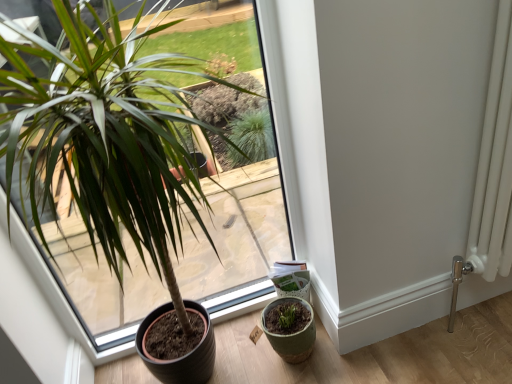
What do you see at coordinates (136, 171) in the screenshot? I see `green matte plant pot at lower left` at bounding box center [136, 171].

Identify the location of green matte plant pot at lower left. The image size is (512, 384). (136, 171).

Identify the location of green matte flowerpot at lower right. (290, 330).

In order to face green matte flowerpot at lower right, should I rotate leftwards or rightwards?

Rotate your view right by about 4.268°.

What do you see at coordinates (290, 330) in the screenshot? I see `green matte flowerpot at lower right` at bounding box center [290, 330].

The image size is (512, 384). Identify the location of green matte plant pot at lower left. (136, 171).

Would you say green matte plant pot at lower left is to the left or to the right of green matte flowerpot at lower right in the picture?

Based on their positions, green matte plant pot at lower left is located to the left of green matte flowerpot at lower right.

Is green matte plant pot at lower left in front of or behind green matte flowerpot at lower right in the image?

Visually, green matte plant pot at lower left is located in front of green matte flowerpot at lower right.

Is point (211, 214) farther from camera compared to point (266, 331)?

That is True.

From the image's perspective, would you say green matte plant pot at lower left is positioned over green matte flowerpot at lower right?

Yes, from the image's perspective, green matte plant pot at lower left is on top of green matte flowerpot at lower right.

From a real-world perspective, which is physically below, green matte plant pot at lower left or green matte flowerpot at lower right?

In real-world perspective, green matte flowerpot at lower right is lower.

Is green matte plant pot at lower left wider or thinner than green matte flowerpot at lower right?

In the image, green matte plant pot at lower left appears to be wider than green matte flowerpot at lower right.

In the scene shown: Does green matte plant pot at lower left have a greater height compared to green matte flowerpot at lower right?

Yes, green matte plant pot at lower left is taller than green matte flowerpot at lower right.

Who is smaller, green matte plant pot at lower left or green matte flowerpot at lower right?

With smaller size is green matte flowerpot at lower right.

Do you think green matte plant pot at lower left is within green matte flowerpot at lower right, or outside of it?

The correct answer is: outside.

Is green matte plant pot at lower left directly adjacent to green matte flowerpot at lower right?

No, green matte plant pot at lower left is not touching green matte flowerpot at lower right.

Is green matte flowerpot at lower right at the back of green matte plant pot at lower left?

No, green matte plant pot at lower left is not facing away from green matte flowerpot at lower right.

Can you tell me how much green matte plant pot at lower left and green matte flowerpot at lower right differ in facing direction?

The angle between the facing direction of green matte plant pot at lower left and the facing direction of green matte flowerpot at lower right is 0.564 degrees.

How far apart are green matte plant pot at lower left and green matte flowerpot at lower right?

They are 30.02 inches apart.

The width and height of the screenshot is (512, 384). I want to click on flowerpot on the right of green matte plant pot at lower left, so pos(290,330).

In the image, is green matte flowerpot at lower right on the left side or the right side of green matte plant pot at lower left?

Based on their positions, green matte flowerpot at lower right is located to the right of green matte plant pot at lower left.

In the scene shown: Which is behind, green matte flowerpot at lower right or green matte plant pot at lower left?

green matte flowerpot at lower right is more distant.

Which is less distant, [298,358] or [242,256]?

Point [298,358].

From the image's perspective, which object appears higher, green matte flowerpot at lower right or green matte plant pot at lower left?

green matte plant pot at lower left, from the image's perspective.

From a real-world perspective, which is physically below, green matte flowerpot at lower right or green matte plant pot at lower left?

green matte flowerpot at lower right, from a real-world perspective.

Is green matte flowerpot at lower right thinner than green matte plant pot at lower left?

Yes, green matte flowerpot at lower right is thinner than green matte plant pot at lower left.

Which of these two, green matte flowerpot at lower right or green matte plant pot at lower left, stands taller?

With more height is green matte plant pot at lower left.

Does green matte flowerpot at lower right have a smaller size compared to green matte plant pot at lower left?

Yes, green matte flowerpot at lower right is smaller than green matte plant pot at lower left.

Would you say green matte flowerpot at lower right is inside or outside green matte plant pot at lower left?

The correct answer is: inside.

Are green matte flowerpot at lower right and green matte plant pot at lower left making contact?

No, green matte flowerpot at lower right is not in contact with green matte plant pot at lower left.

Does green matte flowerpot at lower right turn towards green matte plant pot at lower left?

No, green matte flowerpot at lower right is not turned towards green matte plant pot at lower left.

Can you tell me how much green matte flowerpot at lower right and green matte plant pot at lower left differ in facing direction?

They differ by 0.564 degrees in their facing directions.

Where is `flowerpot behind the green matte plant pot at lower left`? Image resolution: width=512 pixels, height=384 pixels. flowerpot behind the green matte plant pot at lower left is located at coordinates (290, 330).

In order to click on flowerpot behind the green matte plant pot at lower left in this screenshot , I will do `click(290, 330)`.

Find the location of a particular element. The width and height of the screenshot is (512, 384). flowerpot that appears on the right of green matte plant pot at lower left is located at coordinates (290, 330).